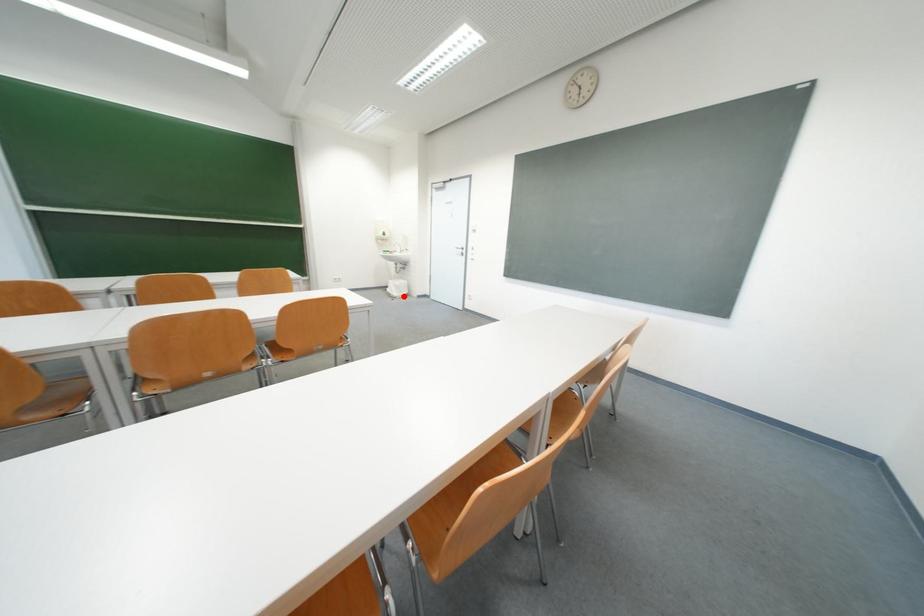
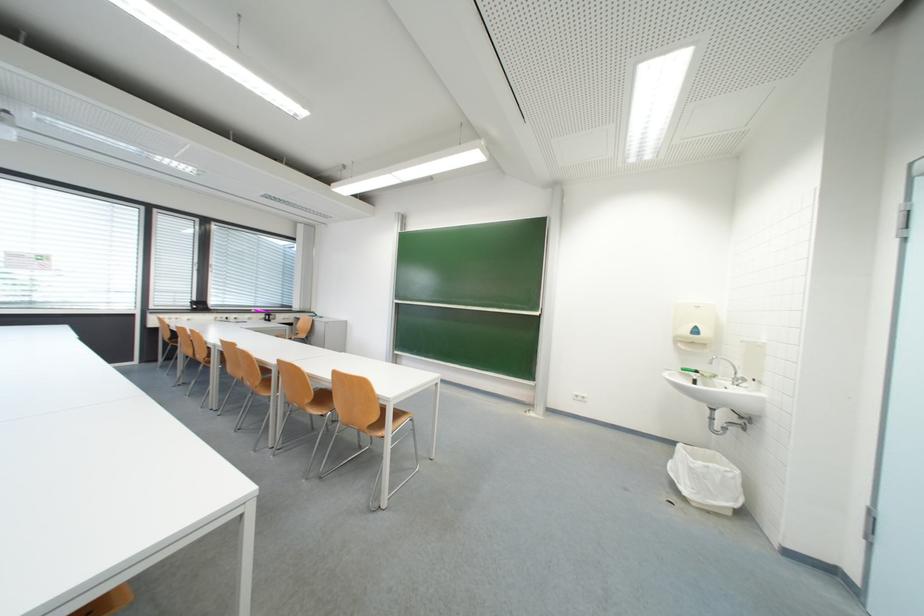
Question: A red point is marked in image1. In image2, is the corresponding 3D point closer to the camera or farther? Reply with the corresponding letter.

Choices:
 (A) The corresponding 3D point is closer.
 (B) The corresponding 3D point is farther.

Answer: (B)